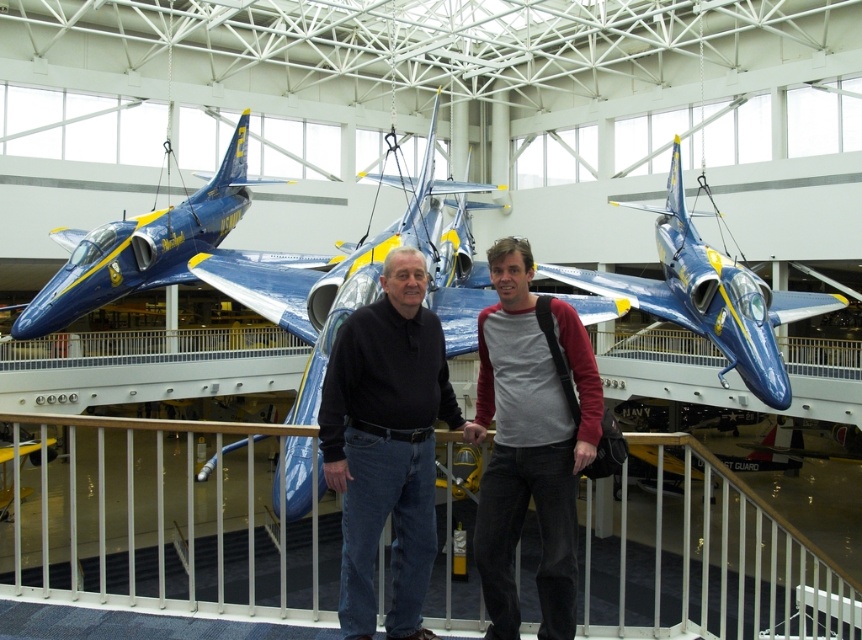
Looking at this image, you are a visitor at the aviation museum and want to take a photo of the aircraft through the white metal railing at lower center without the black matte shirt at center blocking the view. Is the railing tall enough to block the shirt from being in the photo?

The white metal railing at lower center is much taller than the black matte shirt at center, so it can block the shirt from being in the photo.